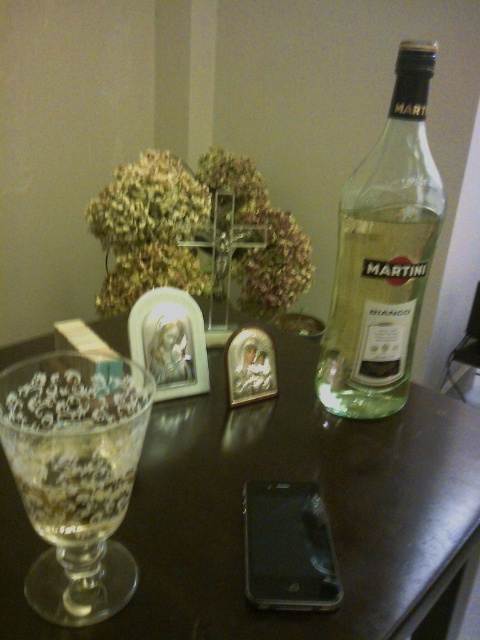
Based on the photo, which is more to the left, transparent textured glass at left or clear glass bottle at right?

transparent textured glass at left

From the picture: Does transparent textured glass at left have a lesser height compared to clear glass bottle at right?

Yes.

The image size is (480, 640). What do you see at coordinates (75, 476) in the screenshot? I see `transparent textured glass at left` at bounding box center [75, 476].

Image resolution: width=480 pixels, height=640 pixels. What are the coordinates of `transparent textured glass at left` in the screenshot? It's located at (75, 476).

Who is positioned more to the left, transparent textured glass at left or transparent plastic smartphone at center?

From the viewer's perspective, transparent textured glass at left appears more on the left side.

Does transparent textured glass at left have a smaller size compared to transparent plastic smartphone at center?

No, transparent textured glass at left is not smaller than transparent plastic smartphone at center.

Find the location of `transparent textured glass at left`. transparent textured glass at left is located at coordinates (75, 476).

This screenshot has width=480, height=640. I want to click on transparent textured glass at left, so click(x=75, y=476).

Is clear glass bottle at right positioned in front of transparent plastic smartphone at center?

No, it is not.

Can you confirm if clear glass bottle at right is positioned below transparent plastic smartphone at center?

No.

I want to click on clear glass bottle at right, so click(x=384, y=253).